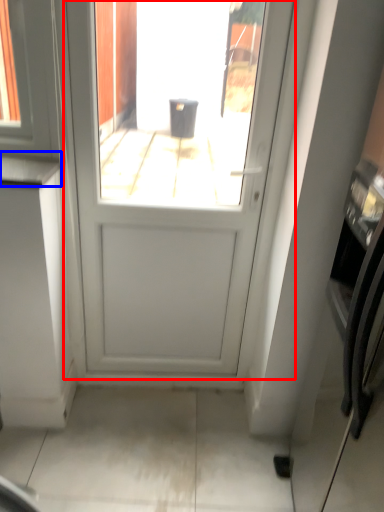
Question: Which of the following is the farthest to the observer, door (highlighted by a red box) or counter top (highlighted by a blue box)?

Choices:
 (A) door
 (B) counter top

Answer: (B)